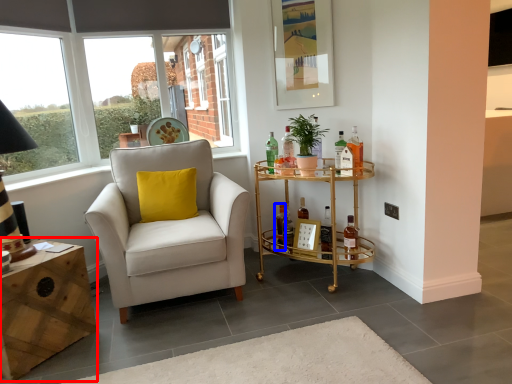
Question: Among these objects, which one is nearest to the camera, desk (highlighted by a red box) or bottle (highlighted by a blue box)?

Choices:
 (A) desk
 (B) bottle

Answer: (A)